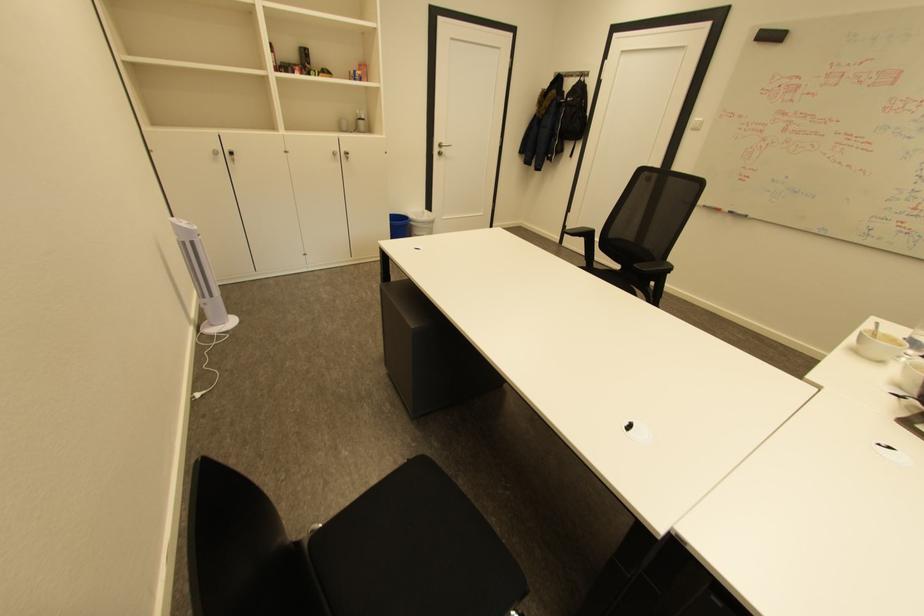
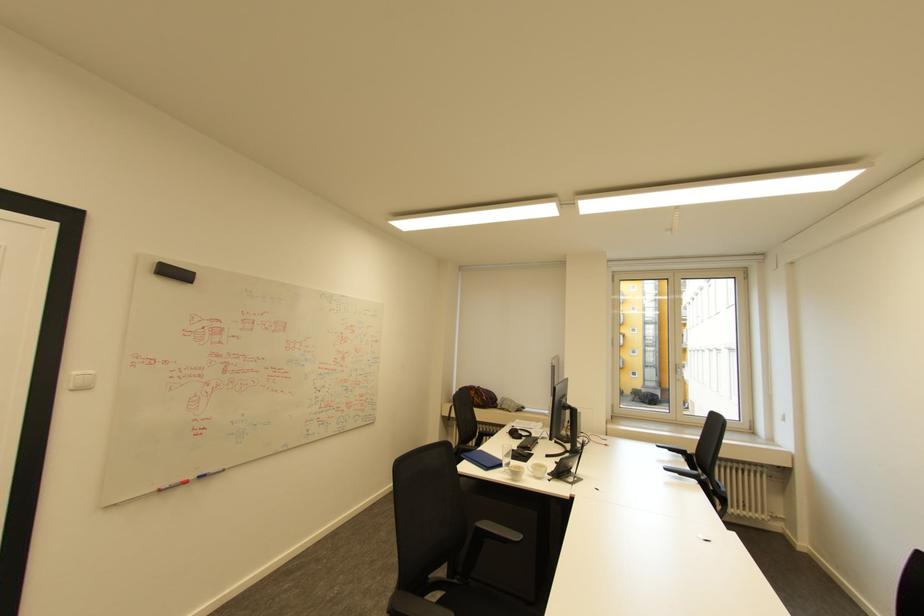
Where in the second image is the point corresponding to pixel 701 119 from the first image?

(79, 371)